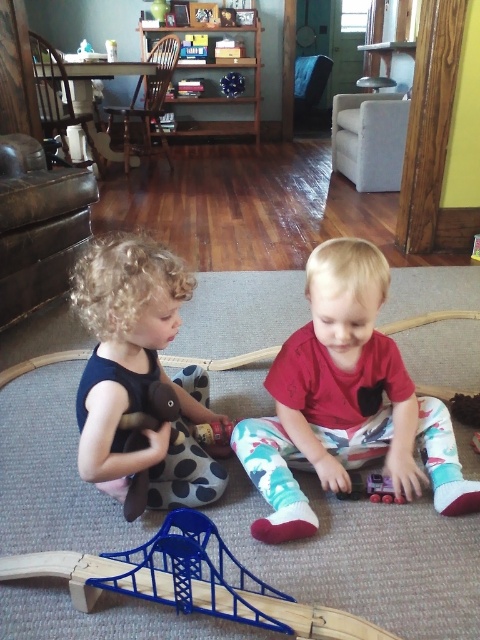
You are a parent trying to organize toys in the living room. You need to place the soft black dress at left and the rubberized plastic train at center into a storage bin. Which object should you pick up first to ensure you can reach the one behind it?

The soft black dress at left is to the left of the rubberized plastic train at center, so you should pick up the soft black dress at left first to access the train behind it.

You are a parent trying to pick up the soft black dress at left and the rubberized plastic train at center from the floor. Which item should you pick up first to avoid stepping on the other one?

The soft black dress at left is in front of the rubberized plastic train at center, so you should pick up the rubberized plastic train at center first to avoid stepping on the soft black dress at left.

You are a parent trying to store the red matte toy car at center and the rubberized plastic train at center in a drawer that is 12 inches wide. Based on their sizes, can both fit side by side without overlapping?

The red matte toy car at center might be wider than the rubberized plastic train at center. Since the drawer is 12 inches wide, if the car is wider than the train, their combined width could exceed the drawer space. Without exact measurements, it is uncertain if both will fit side by side.